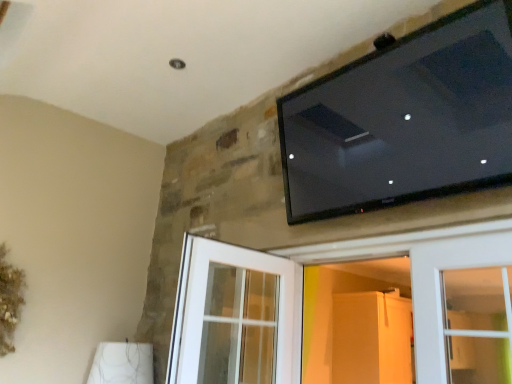
What is the approximate width of white matte refrigerator at lower right?

It is 75.93 centimeters.

This screenshot has width=512, height=384. Identify the location of white matte refrigerator at lower right. (358, 323).

What is the approximate height of white matte refrigerator at lower right?

The height of white matte refrigerator at lower right is 3.39 feet.

This screenshot has height=384, width=512. What do you see at coordinates (358, 323) in the screenshot?
I see `white matte refrigerator at lower right` at bounding box center [358, 323].

Find the location of `white matte refrigerator at lower right`. white matte refrigerator at lower right is located at coordinates (358, 323).